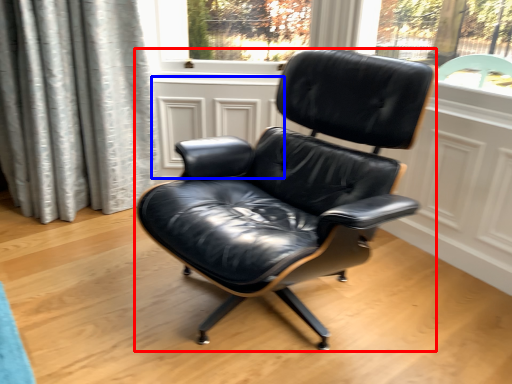
Question: Among these objects, which one is nearest to the camera, chair (highlighted by a red box) or screen door (highlighted by a blue box)?

Choices:
 (A) chair
 (B) screen door

Answer: (A)